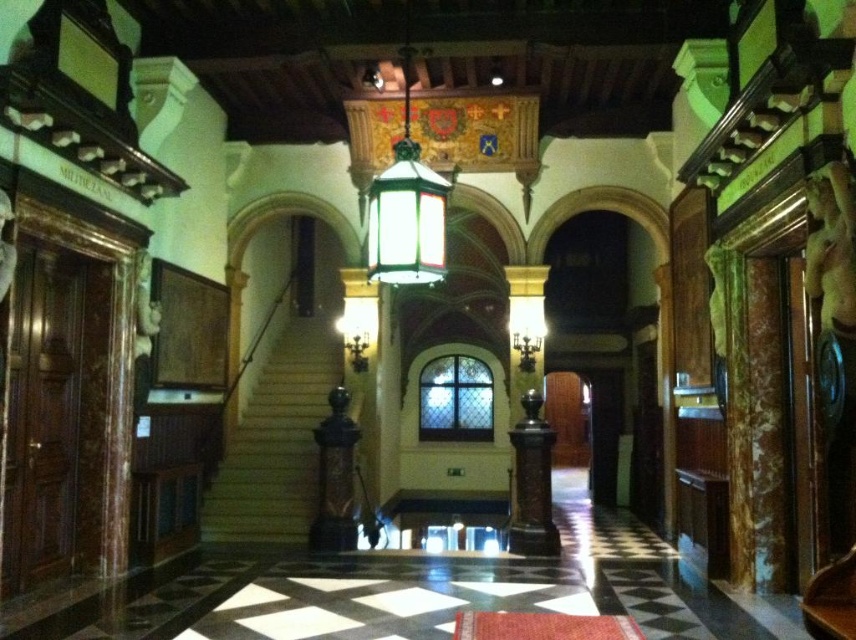
You are an interior designer planning to place a large sofa in this room. The sofa is 2 meters wide. You see the wooden staircase at center and the brown polished wood pillar at center. Which object should you consider the width of to ensure the sofa fits comfortably without blocking the staircase?

You should consider the width of the wooden staircase at center because it might be wider than the brown polished wood pillar at center, so measuring its width will help ensure the sofa fits without obstruction.

Where is the wooden staircase at center located in the image?

The wooden staircase at center is located at point (276, 442).

In the scene shown: You are an interior designer planning to install a new chandelier. You have two options based on the existing fixtures. The first option is a large chandelier that requires a 3m diameter space. The second is a smaller one needing 1.5m. Given the wooden staircase at center and the brown polished wood pillar at center, which option would you choose and why?

The wooden staircase at center is larger in size than the brown polished wood pillar at center. Since the staircase is larger, the large chandelier requiring 3m diameter would be appropriate to match its scale.